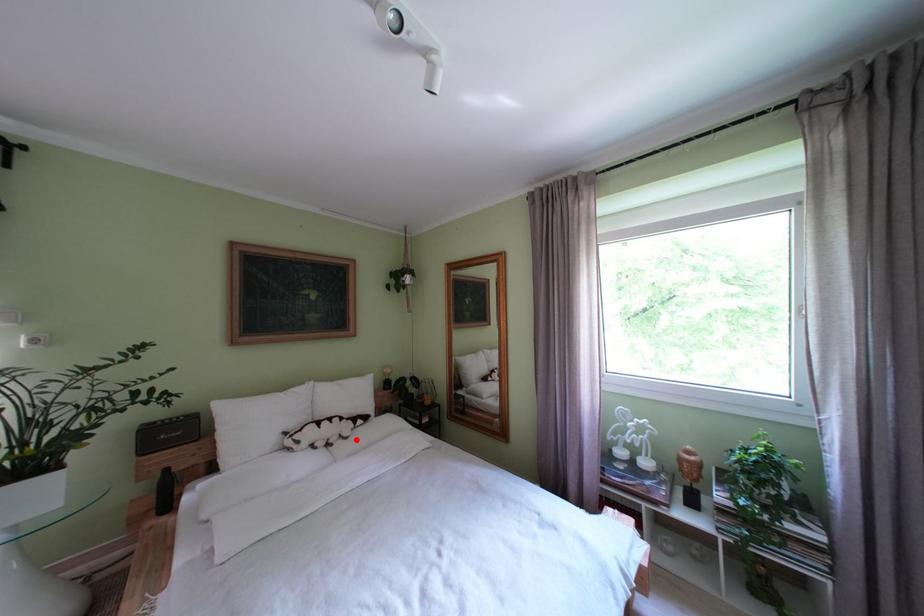
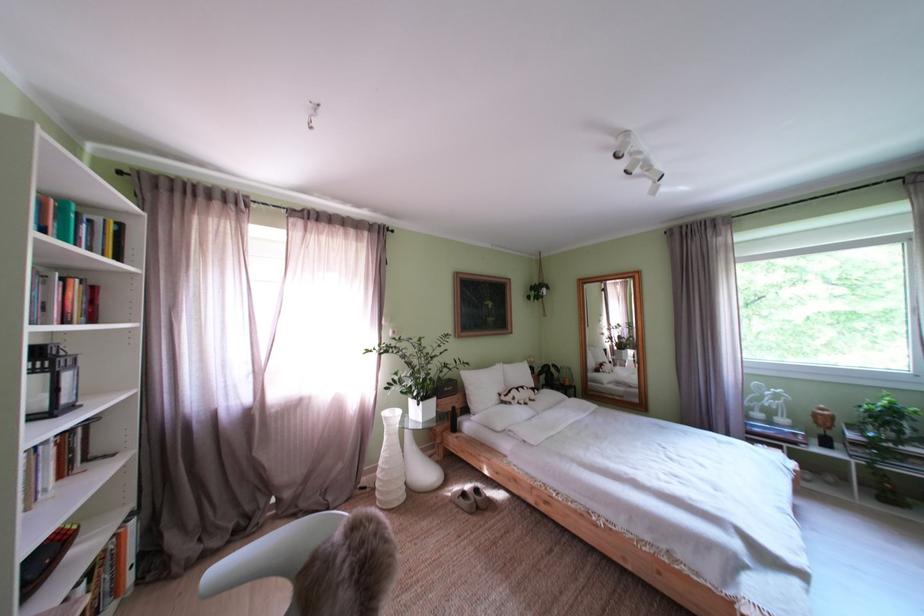
Question: I am providing you with two images of the same scene from different viewpoints. Given a red point in image1, look at the same physical point in image2. Is it:

Choices:
 (A) Closer to the viewpoint
 (B) Farther from the viewpoint

Answer: (B)